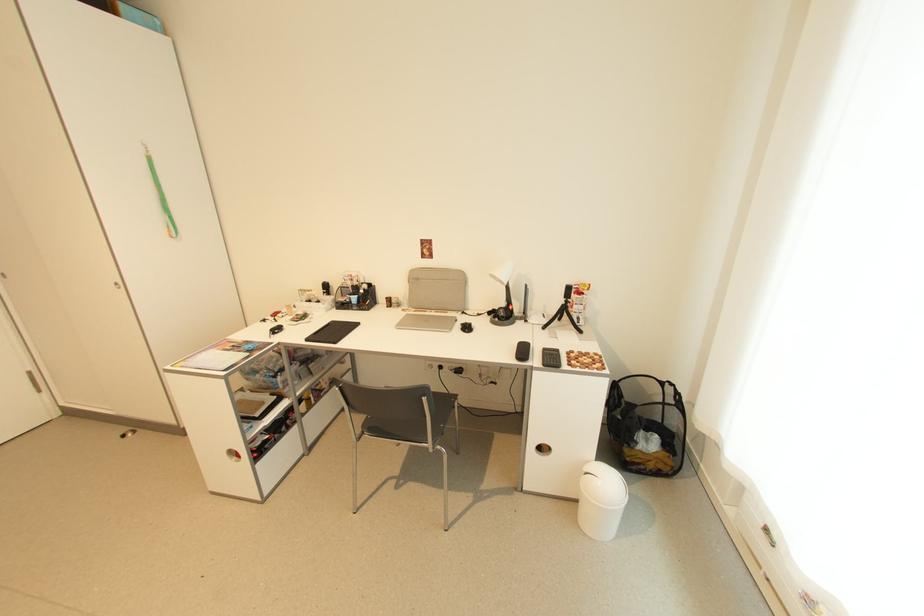
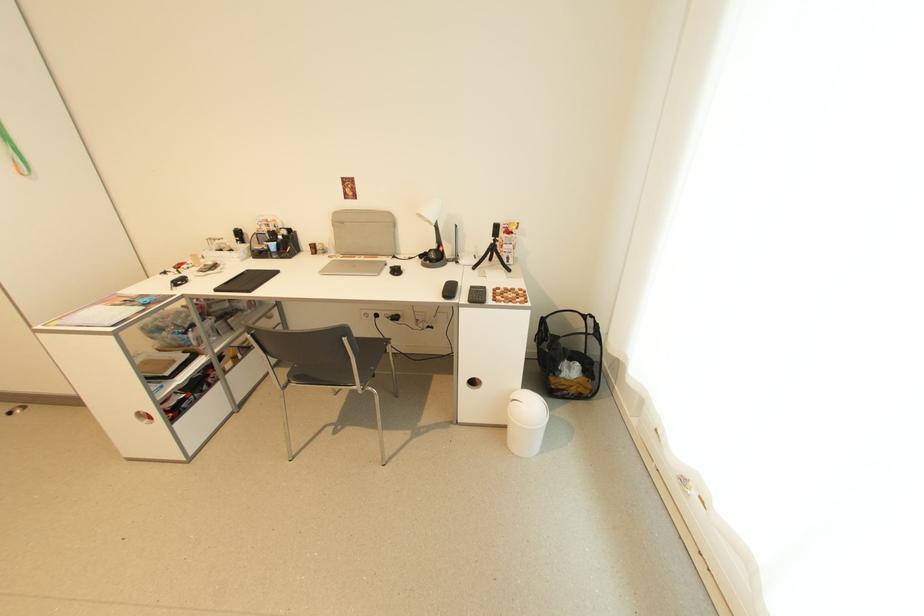
Find the pixel in the second image that matches [460,322] in the first image.

(391, 265)